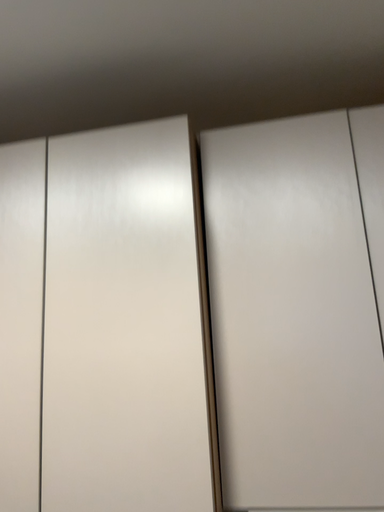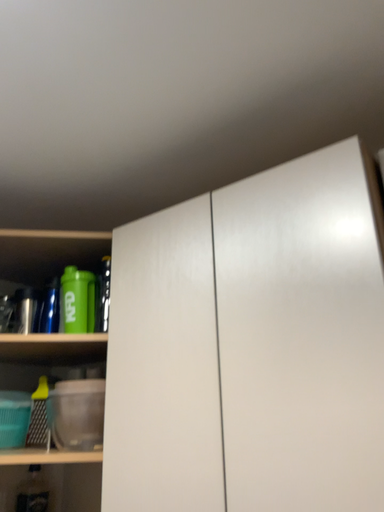
Question: Which way did the camera rotate in the video?

Choices:
 (A) rotated left
 (B) rotated right

Answer: (A)